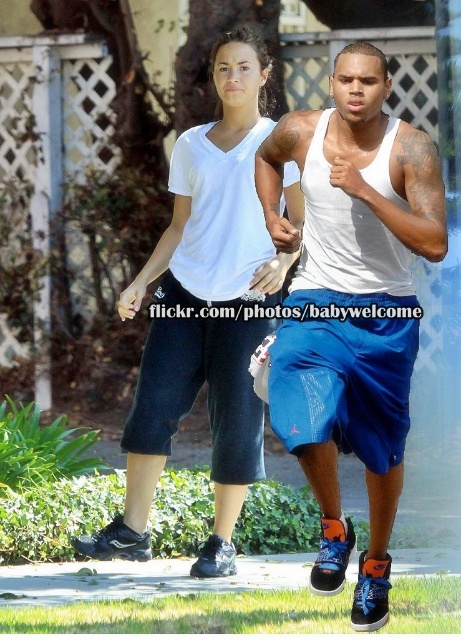
Question: Does blue fabric shorts at center come behind black synthetic running shoe at lower left?

Choices:
 (A) no
 (B) yes

Answer: (A)

Question: Which point is closer to the camera?

Choices:
 (A) black synthetic running shoe at lower left
 (B) blue fabric shorts at center

Answer: (B)

Question: Which object is farther from the camera taking this photo?

Choices:
 (A) blue fabric shorts at center
 (B) black synthetic running shoe at lower left

Answer: (B)

Question: Is blue fabric shorts at center below black synthetic running shoe at lower left?

Choices:
 (A) no
 (B) yes

Answer: (A)

Question: Does blue fabric shorts at center appear on the left side of black synthetic running shoe at lower left?

Choices:
 (A) yes
 (B) no

Answer: (B)